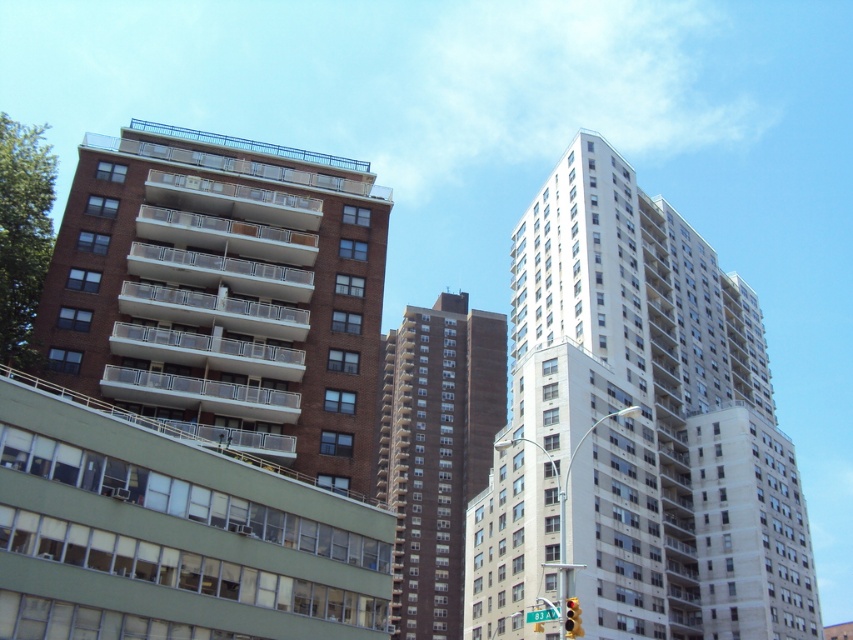
You are a city planner reviewing a map of the area. You see the white smooth building at center and the green plastic street sign at center. According to the map, which one is positioned to the right of the other?

The white smooth building at center is positioned to the right of the green plastic street sign at center according to the map.

You are standing in the middle of the city square and see two brown brick buildings. One is labeled as the brown brick building at upper left and the other as the brown brick building at center. Which one is located to the left when facing the buildings?

The brown brick building at upper left is positioned on the left side of the brown brick building at center, so when facing the buildings, the brown brick building at upper left is to the left of the brown brick building at center.

You are an architect designing a new city park between the white smooth building at center and the brown brick building at center. If the park needs to be 10 meters wide, can it fit between them based on their widths?

The white smooth building at center is wider than the brown brick building at center. However, the exact widths are not provided, so we cannot determine if the 10 meter wide park can fit between them.